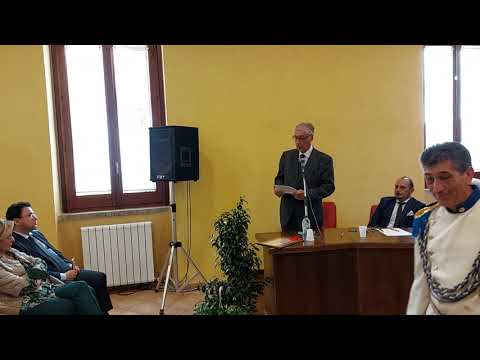
Find the location of a particular element. window frame is located at coordinates (459, 99), (115, 112), (60, 133), (164, 104).